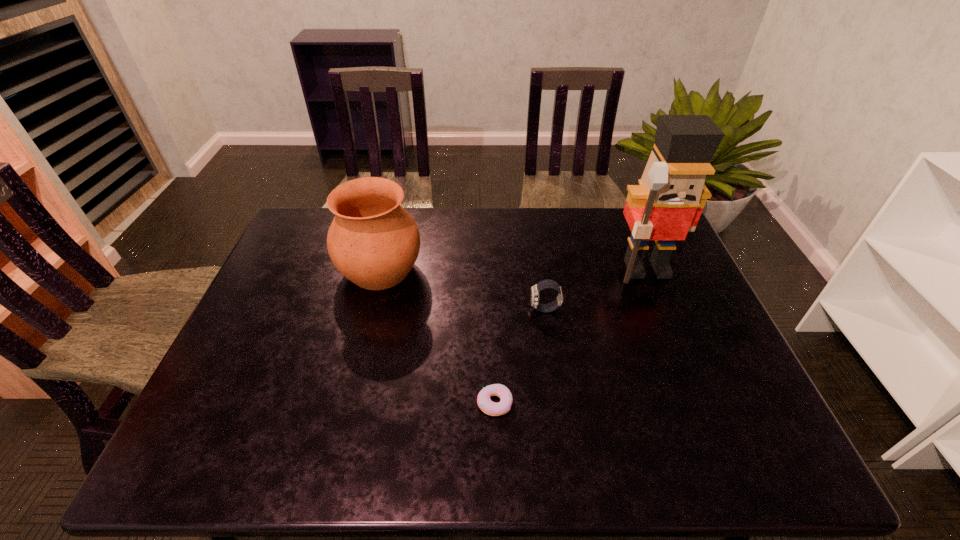
Where is `vacant space that's between the second object from left to right and the second shortest object`? vacant space that's between the second object from left to right and the second shortest object is located at coordinates (520, 356).

I want to click on free space between the watch and the rightmost object, so click(596, 289).

This screenshot has height=540, width=960. In order to click on vacant point located between the watch and the nutcracker in this screenshot , I will do `click(596, 289)`.

Identify the location of the third closest object to the tallest object. (373, 241).

Where is `object that ranks as the third closest to the second nearest object`? The image size is (960, 540). object that ranks as the third closest to the second nearest object is located at coordinates click(373, 241).

I want to click on free location that satisfies the following two spatial constraints: 1. on the face of the second object from right to left; 2. on the front side of the doughnut, so click(559, 403).

Where is `free space that satisfies the following two spatial constraints: 1. on the face of the second nearest object; 2. on the front side of the third object from right to left`? free space that satisfies the following two spatial constraints: 1. on the face of the second nearest object; 2. on the front side of the third object from right to left is located at coordinates click(559, 403).

Find the location of `free point that satisfies the following two spatial constraints: 1. on the front side of the second object from left to right; 2. on the right side of the pottery`. free point that satisfies the following two spatial constraints: 1. on the front side of the second object from left to right; 2. on the right side of the pottery is located at coordinates (348, 403).

You are a GUI agent. You are given a task and a screenshot of the screen. Output one action in this format:
    pyautogui.click(x=<x>, y=<y>)
    Task: Click on the free space that satisfies the following two spatial constraints: 1. on the face of the second nearest object; 2. on the front side of the shortest object
    
    Given the screenshot: What is the action you would take?
    pyautogui.click(x=559, y=403)